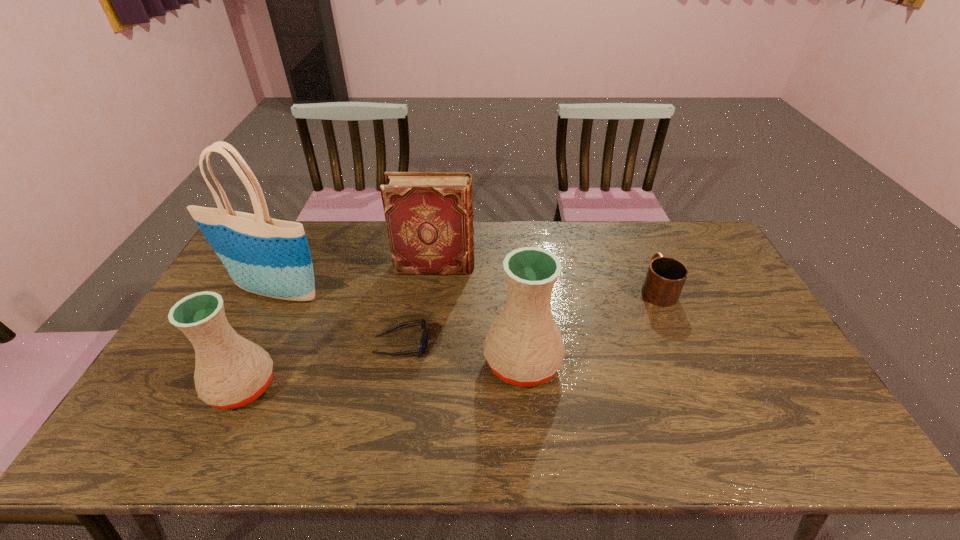
This screenshot has height=540, width=960. What are the coordinates of `the shorter pottery` in the screenshot? It's located at (230, 372).

Identify the location of the left pottery. This screenshot has width=960, height=540. (230, 372).

Where is `the right pottery`? This screenshot has width=960, height=540. the right pottery is located at coordinates (524, 347).

Image resolution: width=960 pixels, height=540 pixels. What are the coordinates of `the taller pottery` in the screenshot? It's located at (524, 347).

Image resolution: width=960 pixels, height=540 pixels. Identify the location of hardback book. (429, 216).

The height and width of the screenshot is (540, 960). I want to click on the rightmost object, so click(x=665, y=278).

The image size is (960, 540). I want to click on the second shortest object, so click(665, 278).

You are a GUI agent. You are given a task and a screenshot of the screen. Output one action in this format:
    pyautogui.click(x=<x>, y=<y>)
    Task: Click on the tote bag
    This screenshot has height=540, width=960.
    Given the screenshot: What is the action you would take?
    pyautogui.click(x=265, y=256)

At what (x,y) coordinates should I click in order to perform the action: click on the shortest object. Please return your answer as a coordinate pair (x, y). This screenshot has height=540, width=960. Looking at the image, I should click on (423, 344).

Identify the location of free region located 0.290m on the back of the left pottery. The width and height of the screenshot is (960, 540). (289, 286).